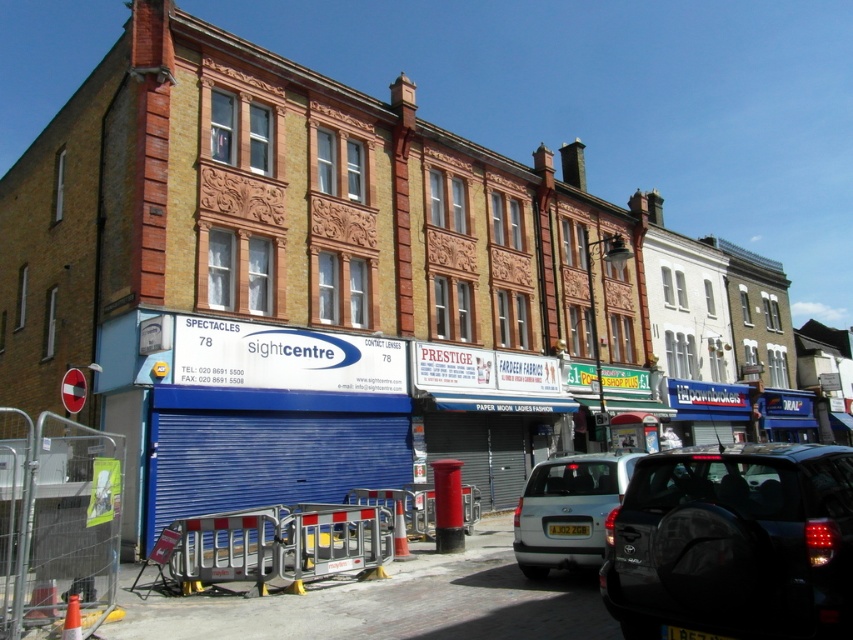
Consider the image. You are a delivery person trying to park your silver metallic car at center in front of the Sightcentre building. There is a metallic silver barricade at lower center in the way. Can you maneuver around the barricade to park your car?

The metallic silver barricade at lower center occupies less space than the silver metallic car at center, so yes, you can maneuver around the barricade to park your silver metallic car at center.

You are a delivery person trying to park your van near the dark gray matte suv at lower right. The parking spot you want is at coordinates point 0.850, 0.860. Can you park your van there if the suv is already occupying that spot?

The dark gray matte suv at lower right is located at point (733, 544), so the parking spot is already occupied by the suv. You cannot park your van there.

You are a delivery person with a 2.5 meter wide truck. You need to park your truck between the dark gray matte suv at lower right and the metallic silver barricade at lower center. Is there enough space for your truck to fit there?

The distance between the dark gray matte suv at lower right and the metallic silver barricade at lower center is 4.81 meters. Since your truck is 2.5 meters wide, there is sufficient space to park between them as the available space is wider than the truck.